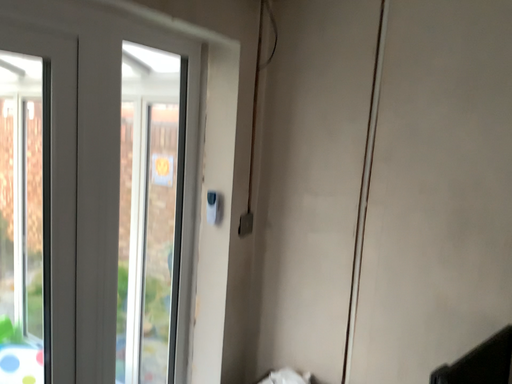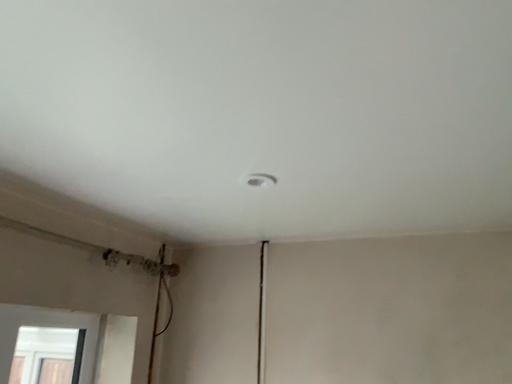
Question: How did the camera likely rotate when shooting the video?

Choices:
 (A) rotated left
 (B) rotated right

Answer: (B)